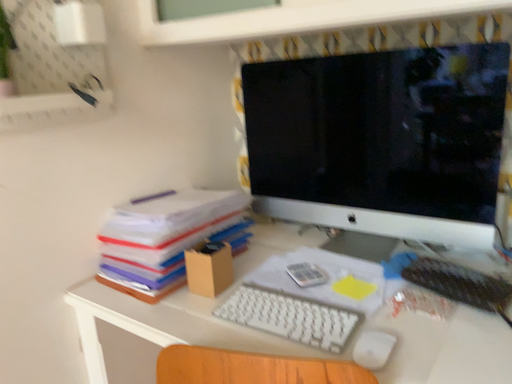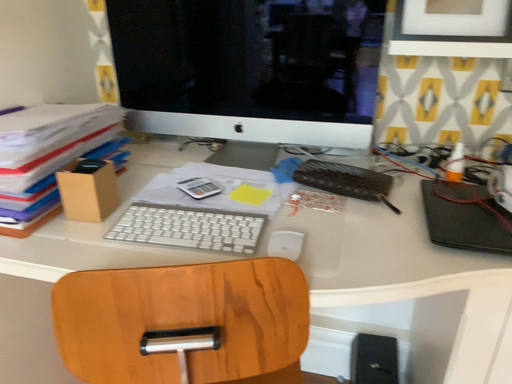
Question: How did the camera likely rotate when shooting the video?

Choices:
 (A) rotated downward
 (B) rotated upward

Answer: (A)